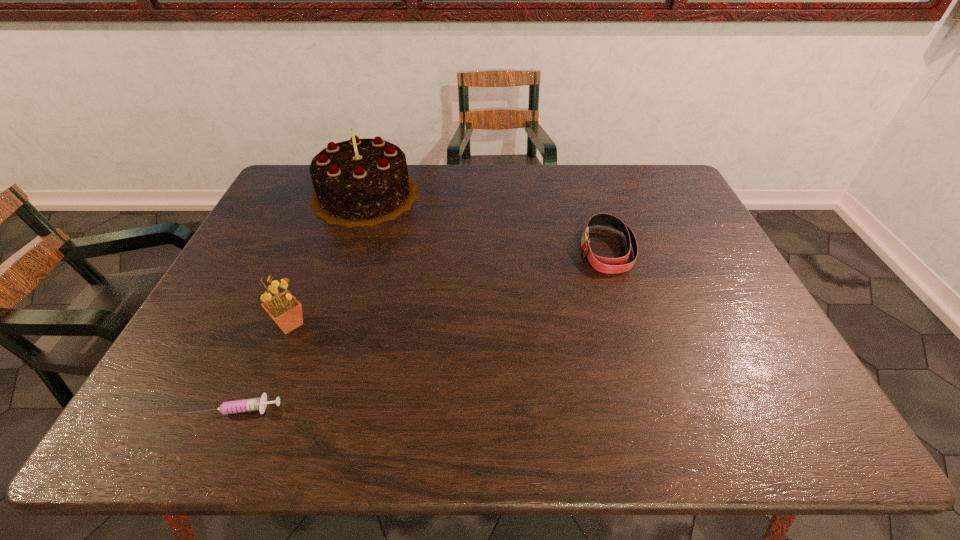
You are a GUI agent. You are given a task and a screenshot of the screen. Output one action in this format:
    pyautogui.click(x=<x>, y=<y>)
    Task: Click on the empty space that is in between the tallest object and the syringe
    Image resolution: width=960 pixels, height=540 pixels.
    Given the screenshot: What is the action you would take?
    (301, 301)

Choose which object is the nearest neighbor to the tallest object. Please provide its 2D coordinates. Your answer should be formatted as a tuple, i.e. [(x, y)], where the tuple contains the x and y coordinates of a point satisfying the conditions above.

[(286, 311)]

Find the location of a particular element. the third closest object to the rightmost object is located at coordinates (253, 404).

The image size is (960, 540). In order to click on free location that satisfies the following two spatial constraints: 1. on the back side of the shortest object; 2. on the right side of the tallest object in this screenshot , I will do `click(329, 195)`.

The image size is (960, 540). I want to click on vacant space that satisfies the following two spatial constraints: 1. on the front side of the birthday cake; 2. at the front of the third shortest object with flowers visible, so click(x=323, y=324).

I want to click on blank space that satisfies the following two spatial constraints: 1. on the back side of the rightmost object; 2. on the right side of the shortest object, so click(x=306, y=249).